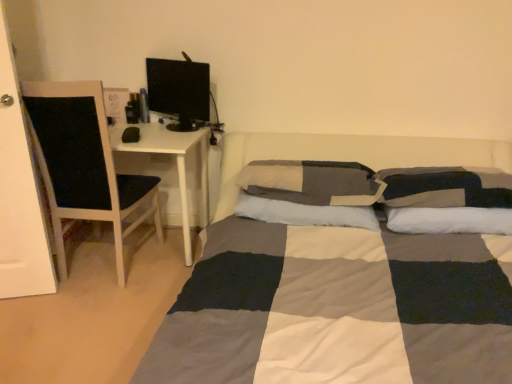
Question: Is soft cotton pillow at center, which is the 3th pillow in right-to-left order, thinner than black glossy computer monitor at upper left?

Choices:
 (A) yes
 (B) no

Answer: (B)

Question: Is soft cotton pillow at center, which is the 3th pillow in right-to-left order, aimed at black glossy computer monitor at upper left?

Choices:
 (A) yes
 (B) no

Answer: (B)

Question: Can you confirm if soft cotton pillow at center, marked as the 1th pillow in a left-to-right arrangement, is positioned to the left of black glossy computer monitor at upper left?

Choices:
 (A) no
 (B) yes

Answer: (A)

Question: Is the depth of soft cotton pillow at center, which is the 3th pillow in right-to-left order, greater than that of black glossy computer monitor at upper left?

Choices:
 (A) yes
 (B) no

Answer: (B)

Question: Does soft cotton pillow at center, which is the 3th pillow in right-to-left order, have a lesser height compared to black glossy computer monitor at upper left?

Choices:
 (A) no
 (B) yes

Answer: (B)

Question: Is soft cotton pillow at center, marked as the 1th pillow in a left-to-right arrangement, wider or thinner than white wood chair at left?

Choices:
 (A) wide
 (B) thin

Answer: (B)

Question: Considering the positions of soft cotton pillow at center, which is the 3th pillow in right-to-left order, and white wood chair at left in the image, is soft cotton pillow at center, which is the 3th pillow in right-to-left order, taller or shorter than white wood chair at left?

Choices:
 (A) tall
 (B) short

Answer: (B)

Question: Is soft cotton pillow at center, which is the 3th pillow in right-to-left order, inside the boundaries of white wood chair at left, or outside?

Choices:
 (A) inside
 (B) outside

Answer: (B)

Question: From the image's perspective, is soft cotton pillow at center, which is the 3th pillow in right-to-left order, located above or below white wood chair at left?

Choices:
 (A) above
 (B) below

Answer: (B)

Question: Does point (48, 178) appear closer or farther from the camera than point (352, 223)?

Choices:
 (A) closer
 (B) farther

Answer: (B)

Question: Is white wood chair at left inside or outside of soft cotton pillow at center, which is the 3th pillow in right-to-left order?

Choices:
 (A) outside
 (B) inside

Answer: (A)

Question: In terms of height, does white wood chair at left look taller or shorter compared to soft cotton pillow at center, which is the 3th pillow in right-to-left order?

Choices:
 (A) short
 (B) tall

Answer: (B)

Question: From a real-world perspective, relative to soft cotton pillow at center, marked as the 1th pillow in a left-to-right arrangement, is white wood chair at left vertically above or below?

Choices:
 (A) above
 (B) below

Answer: (B)

Question: In the image, is black glossy computer monitor at upper left positioned in front of or behind checkered fabric pillow at center, marked as the 2th pillow in a left-to-right arrangement?

Choices:
 (A) front
 (B) behind

Answer: (B)

Question: Considering the relative positions of black glossy computer monitor at upper left and checkered fabric pillow at center, placed as the 2th pillow when sorted from right to left, in the image provided, is black glossy computer monitor at upper left to the left or to the right of checkered fabric pillow at center, placed as the 2th pillow when sorted from right to left,?

Choices:
 (A) right
 (B) left

Answer: (B)